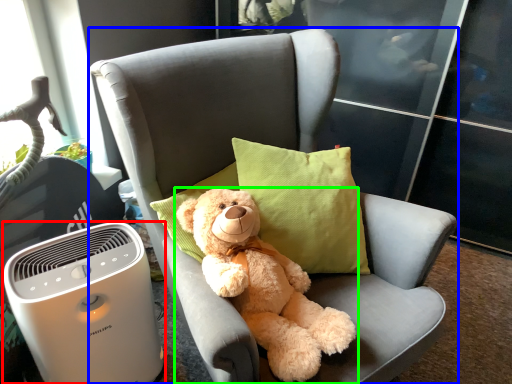
Question: Which object is the closest to the home appliance (highlighted by a red box)? Choose among these: chair (highlighted by a blue box) or teddy bear (highlighted by a green box).

Choices:
 (A) chair
 (B) teddy bear

Answer: (A)